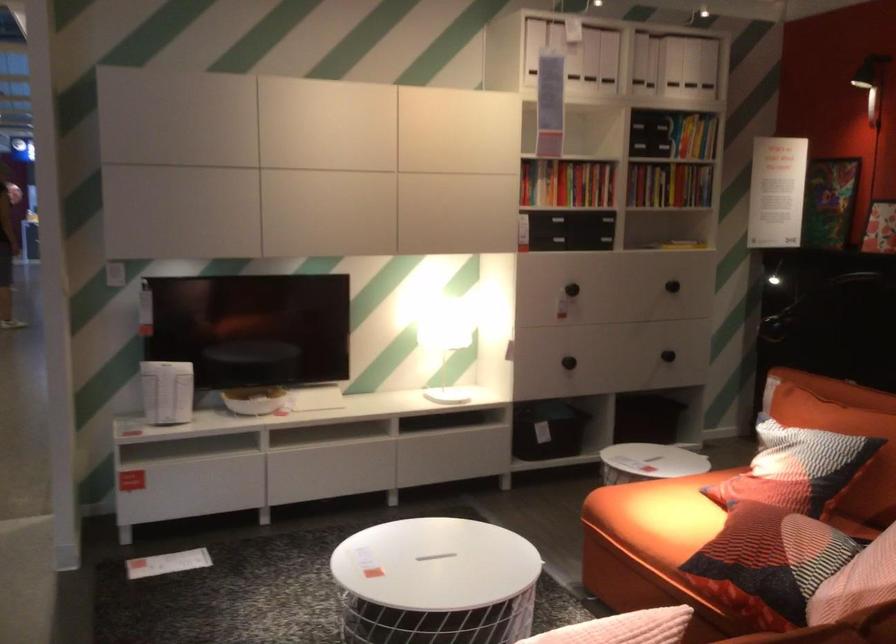
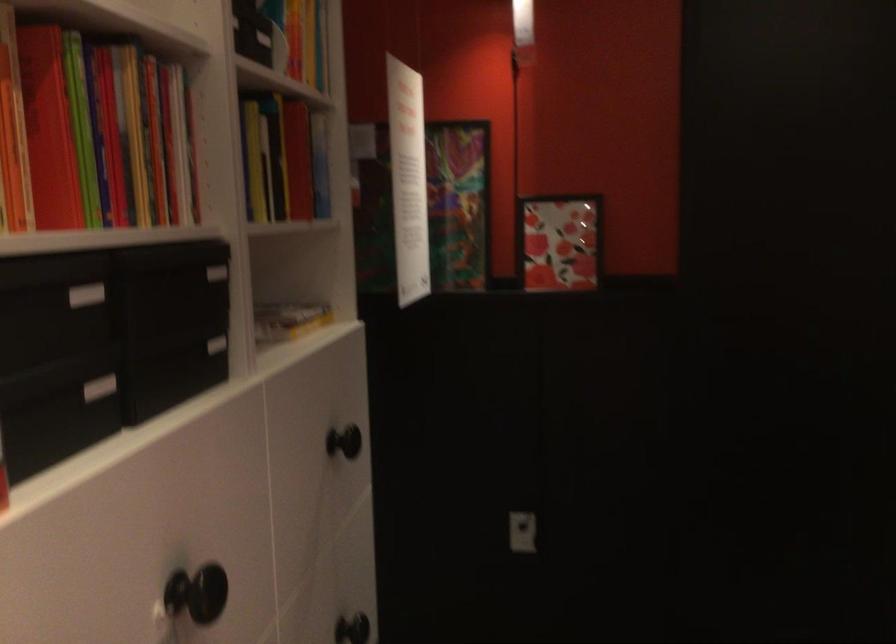
Where in the second image is the point corresponding to the point at 622,211 from the first image?

(216, 345)